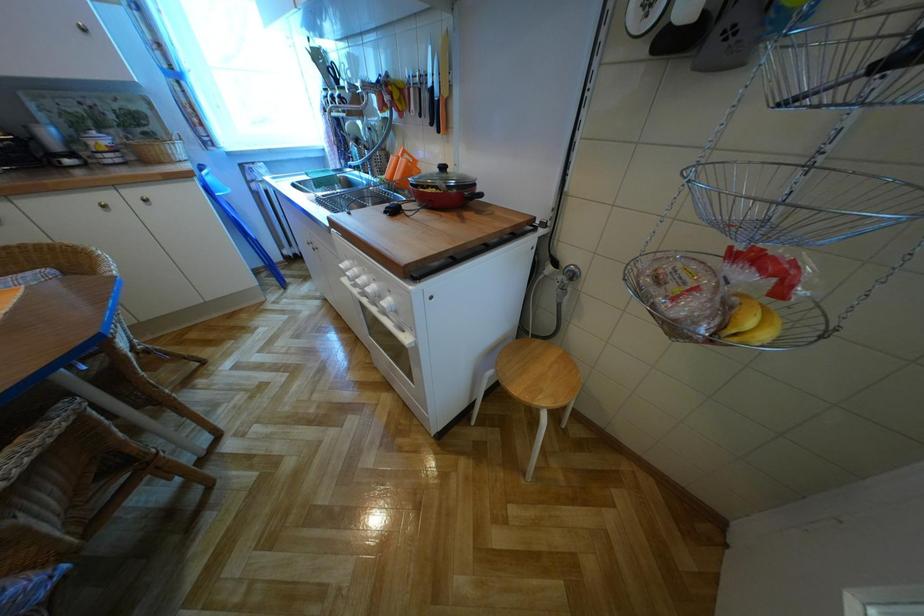
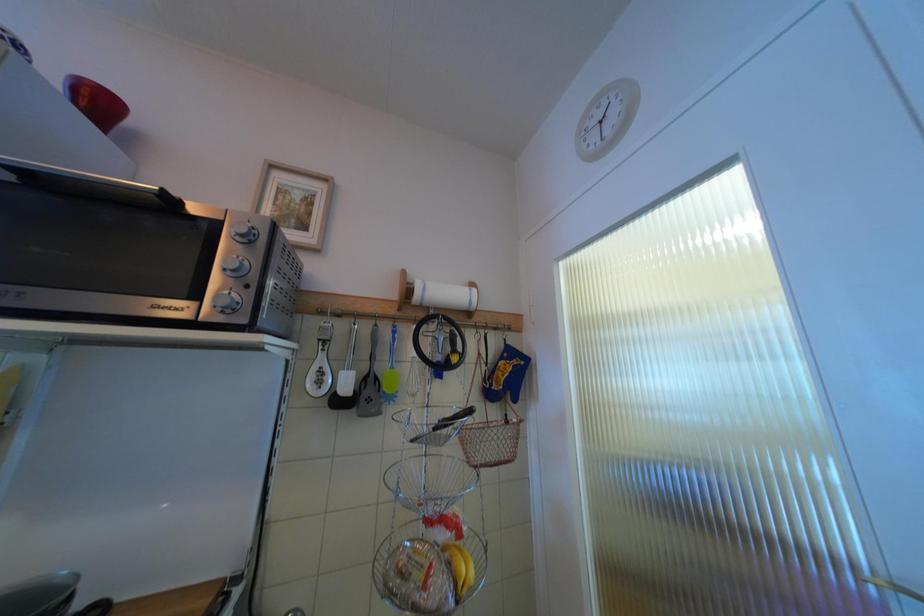
How did the camera likely rotate?

The camera rotated toward right-up.